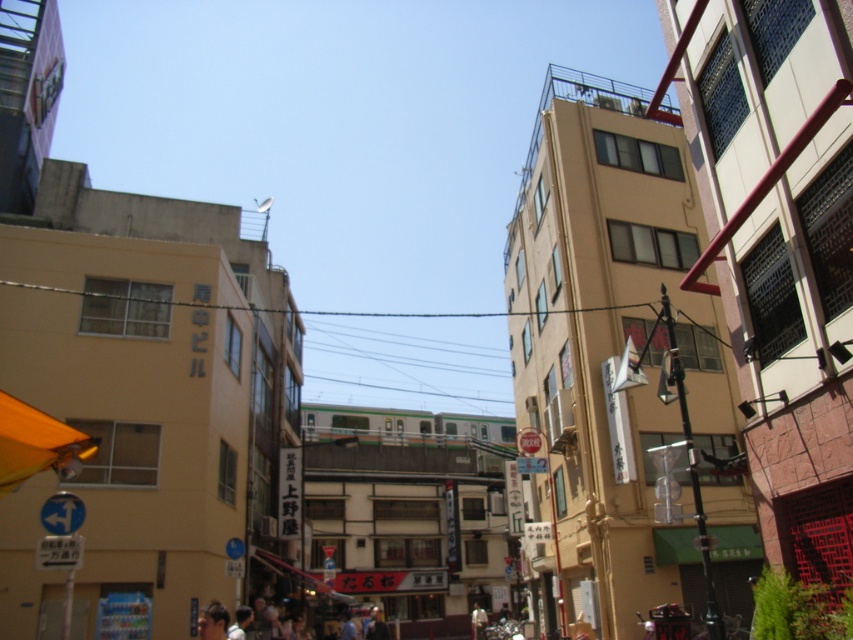
You are standing in the middle of the bustling urban street scene described. There are two points marked in the image, one at coordinates point (328, 312) and the other at point (206, 621). Which of these points is closer to your current position?

Point (328, 312) is further to the camera than point (206, 621), so the point closer to your current position would be point (206, 621).

You are a delivery person carrying a large package and need to pass through the area near the orange fabric umbrella at lower left and the clear wire at center. Can you safely navigate between them without hitting the wire?

The orange fabric umbrella at lower left is positioned under the clear wire at center, so there should be enough vertical space to pass safely as long as you stay below the wire.